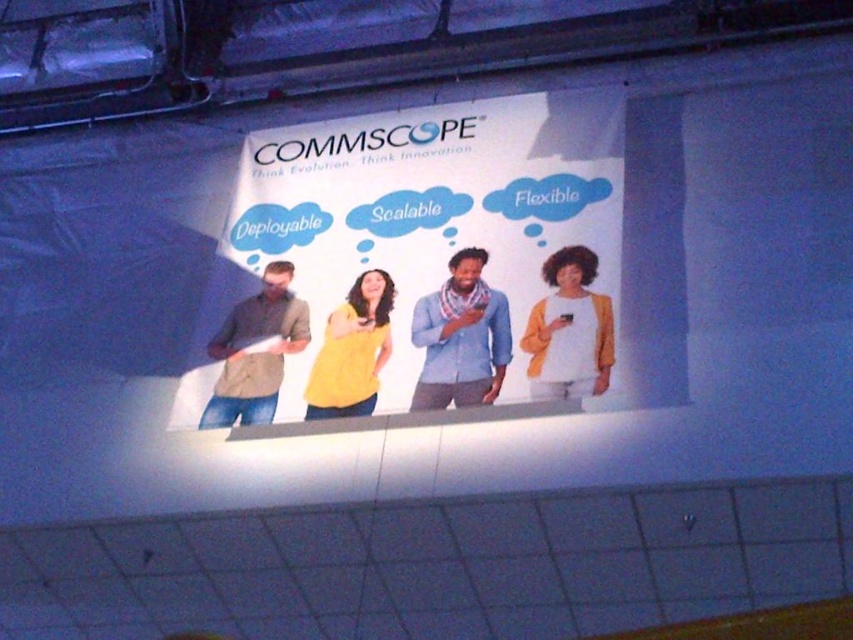
Is white paper at center taller than yellow matte shirt at center?

Yes, white paper at center is taller than yellow matte shirt at center.

Who is taller, white paper at center or yellow matte shirt at center?

Standing taller between the two is white paper at center.

Where is `white paper at center`? This screenshot has width=853, height=640. white paper at center is located at coordinates (436, 212).

Find the location of a particular element. The height and width of the screenshot is (640, 853). white paper at center is located at coordinates (436, 212).

Does matte brown shirt at left appear over yellow matte shirt at center?

No.

Between matte brown shirt at left and yellow matte shirt at center, which one is positioned lower?

Positioned lower is matte brown shirt at left.

Is point (206, 417) positioned behind point (370, 298)?

No, it is in front of (370, 298).

The width and height of the screenshot is (853, 640). In order to click on matte brown shirt at left in this screenshot , I will do `click(254, 352)`.

Who is positioned more to the left, white matte shirt at center or yellow matte shirt at center?

yellow matte shirt at center

Is white matte shirt at center shorter than yellow matte shirt at center?

Indeed, white matte shirt at center has a lesser height compared to yellow matte shirt at center.

Is point (590, 324) in front of point (312, 394)?

Yes, point (590, 324) is closer to viewer.

This screenshot has height=640, width=853. What are the coordinates of `white matte shirt at center` in the screenshot? It's located at (569, 330).